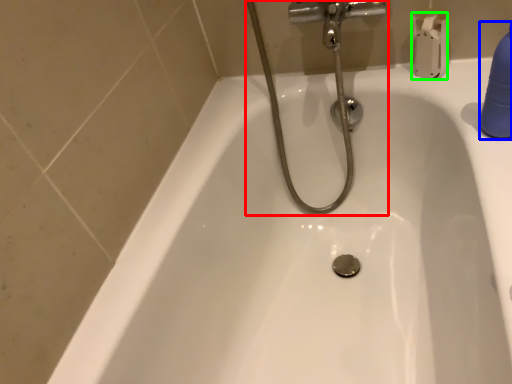
Question: Considering the real-world distances, which object is closest to plumbing fixture (highlighted by a red box)? cleaning product (highlighted by a blue box) or toilet paper (highlighted by a green box).

Choices:
 (A) cleaning product
 (B) toilet paper

Answer: (B)